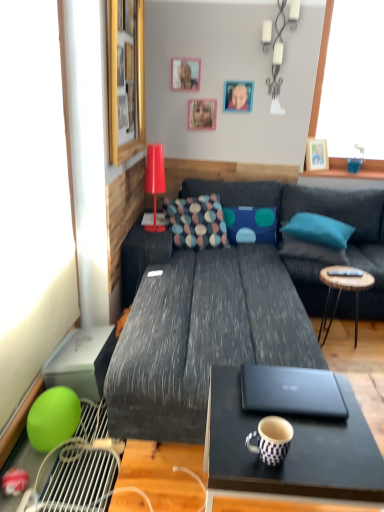
This screenshot has width=384, height=512. I want to click on free spot above black matte laptop at lower center (from a real-world perspective), so click(x=279, y=384).